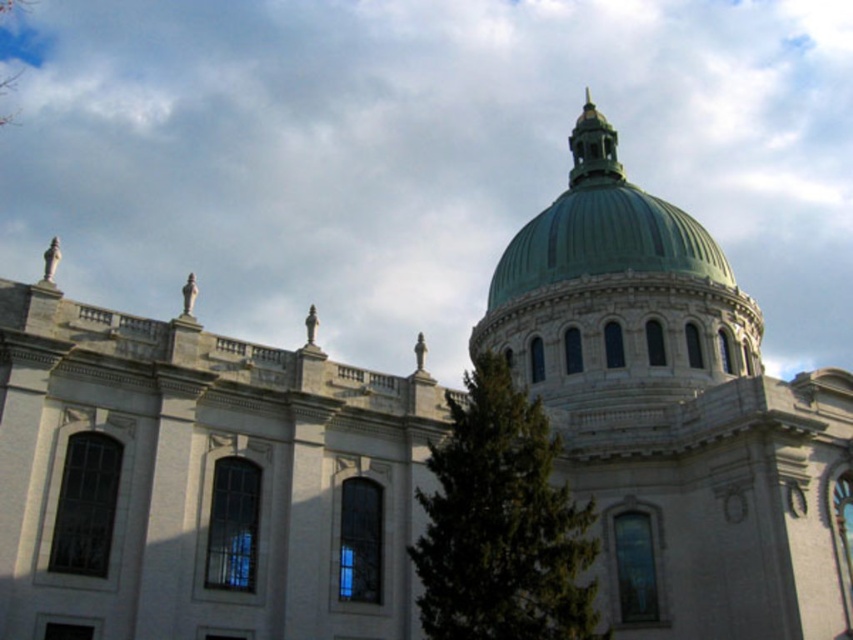
You are standing in front of the grand building and want to determine the relative positions of two points marked on the facade. Which of the two points, point (474, 624) or point (643, 208), is closer to you?

Point (474, 624) is closer to the viewer than point (643, 208).

You are an architect analyzing the symmetry of the building. The white fluffy cloud at upper center and the green polished dome at upper center are both at the upper center of the image. Which one is positioned to the left?

The white fluffy cloud at upper center is to the left of the green polished dome at upper center.

You are an architect visiting the building and want to take a photo that includes both the green leafy tree at center and the green polished dome at upper center. Considering their sizes, which object should you focus on to ensure both fit in the frame?

The green leafy tree at center is smaller than the green polished dome at upper center. To ensure both fit in the frame, focus on the green leafy tree at center first, then adjust the camera to include the larger dome.